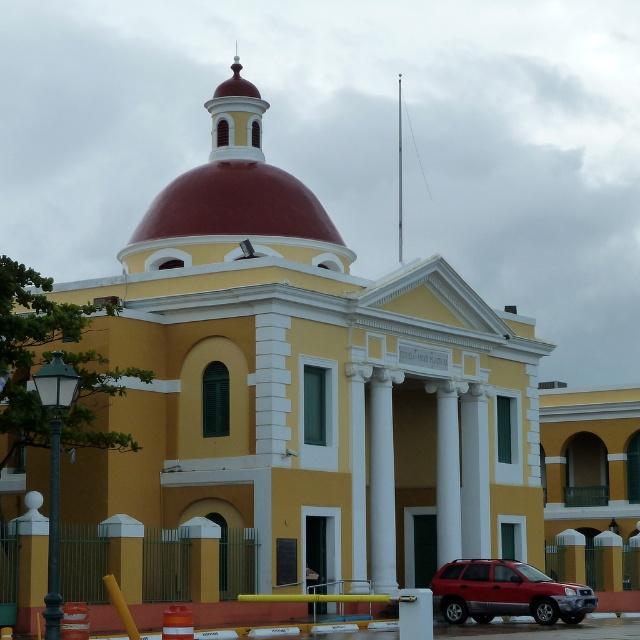
Is white marble column at center to the right of smooth red dome at upper center from the viewer's perspective?

Indeed, white marble column at center is positioned on the right side of smooth red dome at upper center.

Who is shorter, white marble column at center or smooth red dome at upper center?

white marble column at center

Is point (372, 584) positioned behind point (248, 131)?

No, (372, 584) is closer to viewer.

Where is `white marble column at center`? white marble column at center is located at coordinates (381, 481).

Is metallic red suv at lower right smaller than white marble column at center?

No, metallic red suv at lower right is not smaller than white marble column at center.

Between point (502, 572) and point (378, 548), which one is positioned behind?

The point (378, 548) is behind.

The width and height of the screenshot is (640, 640). Find the location of `metallic red suv at lower right`. metallic red suv at lower right is located at coordinates (506, 593).

Can you confirm if metallic red suv at lower right is positioned to the left of smooth red dome at upper center?

Incorrect, metallic red suv at lower right is not on the left side of smooth red dome at upper center.

Does metallic red suv at lower right have a larger size compared to smooth red dome at upper center?

Incorrect, metallic red suv at lower right is not larger than smooth red dome at upper center.

Is point (467, 608) positioned before point (211, 141)?

Yes, it is.

Image resolution: width=640 pixels, height=640 pixels. I want to click on metallic red suv at lower right, so click(x=506, y=593).